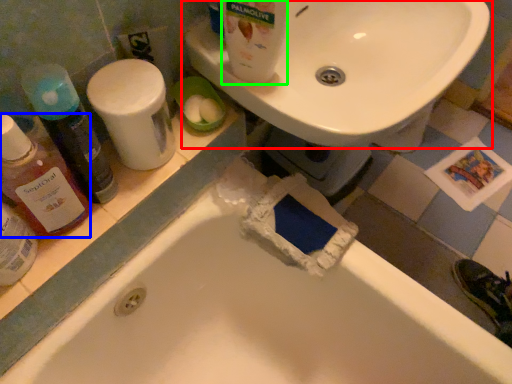
Question: Which object is positioned farthest from sink (highlighted by a red box)? Select from cleaning product (highlighted by a blue box) and cleaning product (highlighted by a green box).

Choices:
 (A) cleaning product
 (B) cleaning product

Answer: (A)